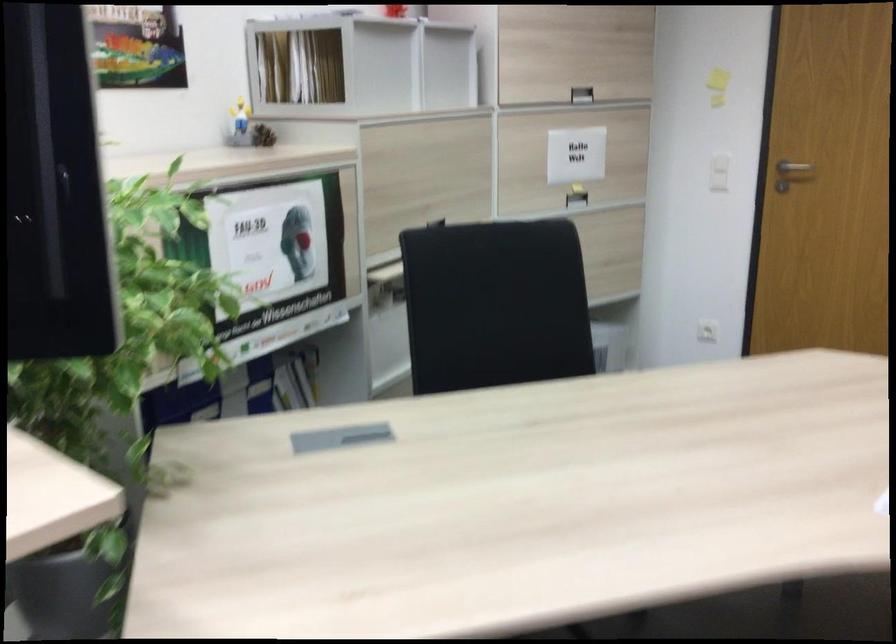
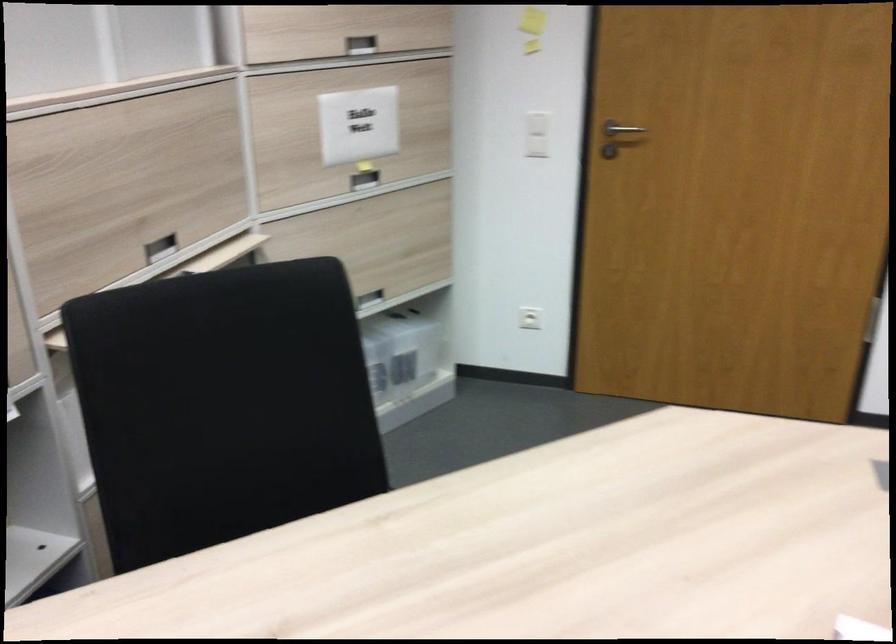
In the second image, find the point that corresponds to [578,153] in the first image.

(358, 125)